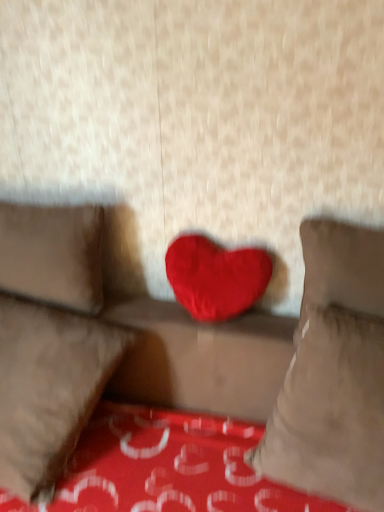
Question: Would you consider red plush heart at center to be distant from suede-like beige pillow at left, the first pillow in the left-to-right sequence?

Choices:
 (A) no
 (B) yes

Answer: (A)

Question: From a real-world perspective, is red plush heart at center beneath suede-like beige pillow at left, the first pillow in the left-to-right sequence?

Choices:
 (A) no
 (B) yes

Answer: (B)

Question: Can you confirm if red plush heart at center is thinner than suede-like beige pillow at left, placed as the third pillow when sorted from right to left?

Choices:
 (A) yes
 (B) no

Answer: (A)

Question: From the image's perspective, does red plush heart at center appear higher than suede-like beige pillow at left, placed as the third pillow when sorted from right to left?

Choices:
 (A) no
 (B) yes

Answer: (A)

Question: Is red plush heart at center at the right side of suede-like beige pillow at left, the first pillow in the left-to-right sequence?

Choices:
 (A) yes
 (B) no

Answer: (A)

Question: Is red plush heart at center to the left of suede-like beige pillow at left, placed as the third pillow when sorted from right to left, from the viewer's perspective?

Choices:
 (A) yes
 (B) no

Answer: (B)

Question: From a real-world perspective, is red plush heart at center located higher than velvet red heart at center, which is the 2th pillow from right to left?

Choices:
 (A) yes
 (B) no

Answer: (A)

Question: Is red plush heart at center taller than velvet red heart at center, which is the 2th pillow from right to left?

Choices:
 (A) yes
 (B) no

Answer: (B)

Question: Considering the relative sizes of red plush heart at center and velvet red heart at center, which is the 2th pillow from left to right, in the image provided, is red plush heart at center wider than velvet red heart at center, which is the 2th pillow from left to right,?

Choices:
 (A) no
 (B) yes

Answer: (A)

Question: Is red plush heart at center behind velvet red heart at center, which is the 2th pillow from left to right?

Choices:
 (A) no
 (B) yes

Answer: (B)

Question: From the image's perspective, does red plush heart at center appear lower than velvet red heart at center, which is the 2th pillow from left to right?

Choices:
 (A) yes
 (B) no

Answer: (B)

Question: From the image's perspective, is red plush heart at center over velvet red heart at center, which is the 2th pillow from left to right?

Choices:
 (A) yes
 (B) no

Answer: (A)

Question: Is red plush heart at center shorter than velvet red heart at center?

Choices:
 (A) no
 (B) yes

Answer: (B)